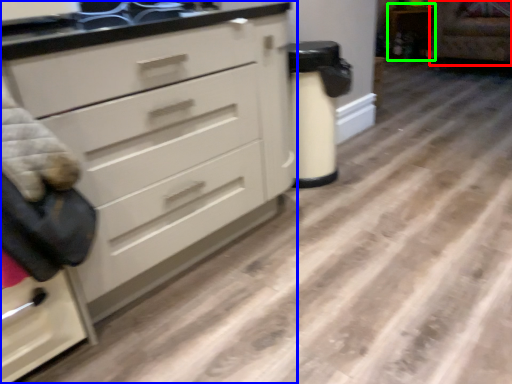
Question: Considering the real-world distances, which object is closest to armchair (highlighted by a red box)? chest of drawers (highlighted by a blue box) or cabinetry (highlighted by a green box).

Choices:
 (A) chest of drawers
 (B) cabinetry

Answer: (B)